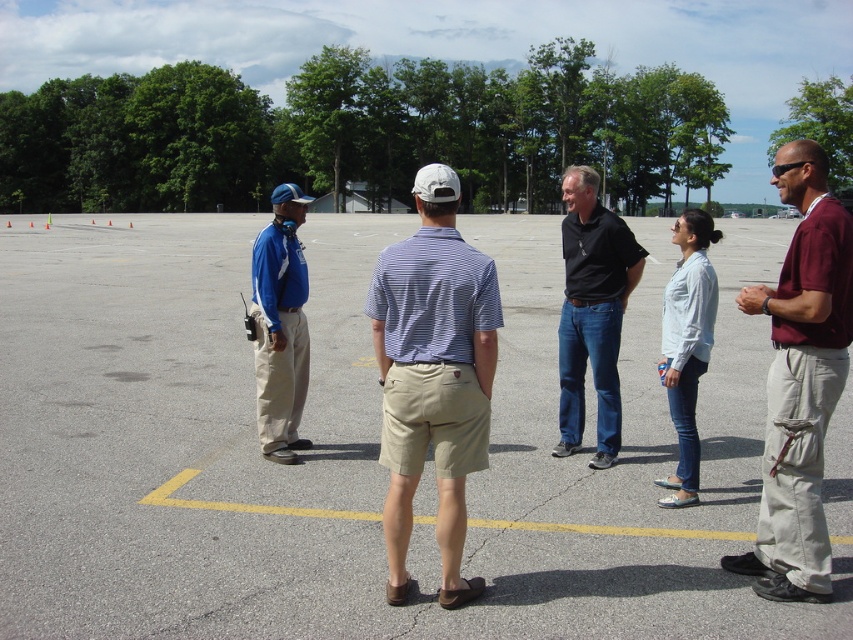
You are a delivery person trying to place a large package on the ground between the gray asphalt parking lot at center and the black cotton shirt at center. Can the package fit between them if it requires 2 meters of space?

The gray asphalt parking lot at center is wider than the black cotton shirt at center, but the description does not specify the exact distance between them. Therefore, it is uncertain whether the package requiring 2 meters of space can fit between them.

Looking at the five people in the image, which of the two individuals wearing a maroon cotton shirt at right and a black cotton shirt at center is positioned to the right of the other?

The maroon cotton shirt at right is positioned to the right of the black cotton shirt at center.